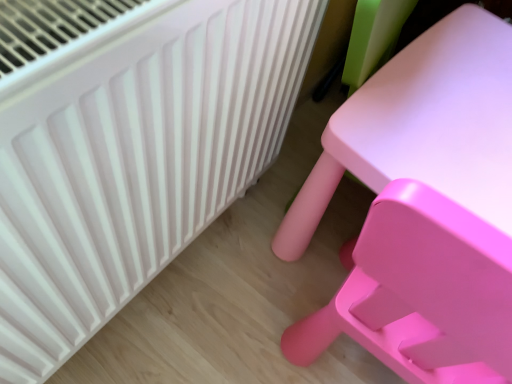
Question: Can you confirm if white plastic radiator at upper left is wider than matte plastic table at right?

Choices:
 (A) yes
 (B) no

Answer: (A)

Question: Is white plastic radiator at upper left positioned behind matte plastic table at right?

Choices:
 (A) no
 (B) yes

Answer: (B)

Question: Does white plastic radiator at upper left have a smaller size compared to matte plastic table at right?

Choices:
 (A) no
 (B) yes

Answer: (B)

Question: Is white plastic radiator at upper left not within matte plastic table at right?

Choices:
 (A) yes
 (B) no

Answer: (A)

Question: From the image's perspective, is white plastic radiator at upper left below matte plastic table at right?

Choices:
 (A) yes
 (B) no

Answer: (A)

Question: Is white plastic radiator at upper left oriented towards matte plastic table at right?

Choices:
 (A) no
 (B) yes

Answer: (A)

Question: Is matte plastic table at right oriented away from white plastic radiator at upper left?

Choices:
 (A) yes
 (B) no

Answer: (B)

Question: From a real-world perspective, does matte plastic table at right sit lower than white plastic radiator at upper left?

Choices:
 (A) no
 (B) yes

Answer: (A)

Question: Considering the relative positions of matte plastic table at right and white plastic radiator at upper left in the image provided, is matte plastic table at right to the right of white plastic radiator at upper left from the viewer's perspective?

Choices:
 (A) yes
 (B) no

Answer: (A)

Question: Can you confirm if matte plastic table at right is thinner than white plastic radiator at upper left?

Choices:
 (A) yes
 (B) no

Answer: (A)

Question: Is matte plastic table at right located outside white plastic radiator at upper left?

Choices:
 (A) yes
 (B) no

Answer: (A)

Question: Is matte plastic table at right positioned behind white plastic radiator at upper left?

Choices:
 (A) no
 (B) yes

Answer: (A)

Question: Is point (40, 18) positioned closer to the camera than point (327, 130)?

Choices:
 (A) farther
 (B) closer

Answer: (B)